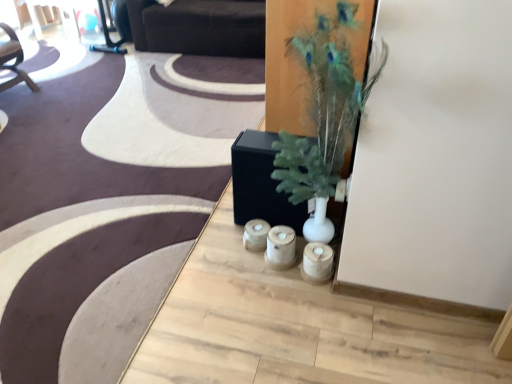
The image size is (512, 384). Describe the element at coordinates (319, 75) in the screenshot. I see `green feathered plant at center` at that location.

At what (x,y) coordinates should I click in order to perform the action: click on green feathered plant at center. Please return your answer as a coordinate pair (x, y). This screenshot has width=512, height=384. Looking at the image, I should click on (319, 75).

Does dark brown leather couch at upper center have a smaller size compared to wooden candle holders at center?

No, dark brown leather couch at upper center is not smaller than wooden candle holders at center.

Considering the relative sizes of dark brown leather couch at upper center and wooden candle holders at center in the image provided, is dark brown leather couch at upper center thinner than wooden candle holders at center?

In fact, dark brown leather couch at upper center might be wider than wooden candle holders at center.

Is dark brown leather couch at upper center turned away from wooden candle holders at center?

That's not correct — dark brown leather couch at upper center is not looking away from wooden candle holders at center.

Which is more to the left, dark brown leather couch at upper center or wooden candle holders at center?

Positioned to the left is dark brown leather couch at upper center.

Could you tell me if green feathered plant at center is turned towards dark brown leather couch at upper center?

No, green feathered plant at center is not turned towards dark brown leather couch at upper center.

Identify the location of couch located on the left of green feathered plant at center. This screenshot has height=384, width=512. (199, 27).

Between green feathered plant at center and dark brown leather couch at upper center, which one has larger width?

dark brown leather couch at upper center.

Between green feathered plant at center and dark brown leather couch at upper center, which one appears on the right side from the viewer's perspective?

Positioned to the right is green feathered plant at center.

Are wooden candle holders at center and dark brown leather couch at upper center located far from each other?

Yes, wooden candle holders at center and dark brown leather couch at upper center are quite far apart.

Considering the positions of objects wooden candle holders at center and dark brown leather couch at upper center in the image provided, who is more to the left, wooden candle holders at center or dark brown leather couch at upper center?

dark brown leather couch at upper center is more to the left.

The image size is (512, 384). I want to click on couch behind the wooden candle holders at center, so click(x=199, y=27).

Which of these two, wooden candle holders at center or green feathered plant at center, is thinner?

wooden candle holders at center.

From a real-world perspective, who is located lower, wooden candle holders at center or green feathered plant at center?

wooden candle holders at center.

Which of these two, wooden candle holders at center or green feathered plant at center, stands taller?

Standing taller between the two is green feathered plant at center.

Is point (277, 245) closer or farther from the camera than point (324, 9)?

Clearly, point (277, 245) is more distant from the camera than point (324, 9).

Can you confirm if dark brown leather couch at upper center is positioned to the left of green feathered plant at center?

Yes, dark brown leather couch at upper center is to the left of green feathered plant at center.

From the picture: How different are the orientations of dark brown leather couch at upper center and green feathered plant at center in degrees?

The angle between the facing direction of dark brown leather couch at upper center and the facing direction of green feathered plant at center is 89.5 degrees.

Considering the positions of objects dark brown leather couch at upper center and green feathered plant at center in the image provided, who is in front, dark brown leather couch at upper center or green feathered plant at center?

green feathered plant at center is more forward.

I want to click on houseplant above the dark brown leather couch at upper center (from a real-world perspective), so click(x=319, y=75).

Is green feathered plant at center oriented away from wooden candle holders at center?

No, green feathered plant at center's orientation is not away from wooden candle holders at center.

Would you say green feathered plant at center is to the left or to the right of wooden candle holders at center in the picture?

In the image, green feathered plant at center appears on the right side of wooden candle holders at center.

Is point (338, 137) closer to camera compared to point (288, 236)?

Yes.

From a real-world perspective, between green feathered plant at center and wooden candle holders at center, who is vertically lower?

In real-world perspective, wooden candle holders at center is lower.

This screenshot has width=512, height=384. In order to click on candle holder below the dark brown leather couch at upper center (from the image's perspective) in this screenshot , I will do `click(280, 248)`.

Identify the location of houseplant above the dark brown leather couch at upper center (from a real-world perspective). (319, 75).

Based on their spatial positions, is green feathered plant at center or dark brown leather couch at upper center closer to wooden candle holders at center?

green feathered plant at center is positioned closer to the anchor wooden candle holders at center.

When comparing their distances from wooden candle holders at center, does dark brown leather couch at upper center or green feathered plant at center seem further?

dark brown leather couch at upper center is positioned further to the anchor wooden candle holders at center.

From the image, which object appears to be farther from green feathered plant at center, wooden candle holders at center or dark brown leather couch at upper center?

Based on the image, dark brown leather couch at upper center appears to be further to green feathered plant at center.

In the scene shown: Considering their positions, is green feathered plant at center positioned further to dark brown leather couch at upper center than wooden candle holders at center?

wooden candle holders at center is further to dark brown leather couch at upper center.

Looking at the image, which one is located closer to green feathered plant at center, dark brown leather couch at upper center or wooden candle holders at center?

wooden candle holders at center is closer to green feathered plant at center.

From the image, which object appears to be farther from dark brown leather couch at upper center, wooden candle holders at center or green feathered plant at center?

The object further to dark brown leather couch at upper center is wooden candle holders at center.

Locate an element on the screen. This screenshot has width=512, height=384. candle holder between green feathered plant at center and dark brown leather couch at upper center in the front-back direction is located at coordinates (280, 248).